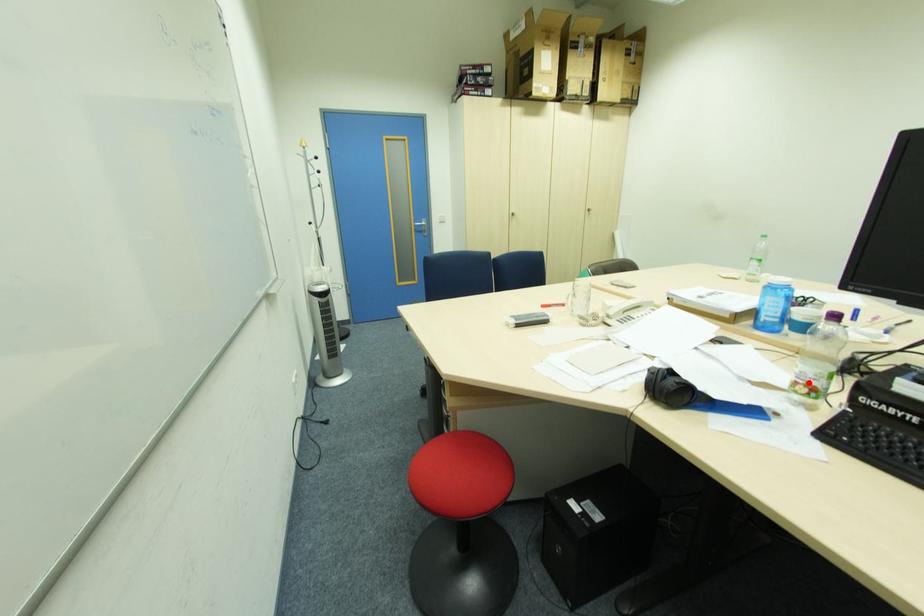
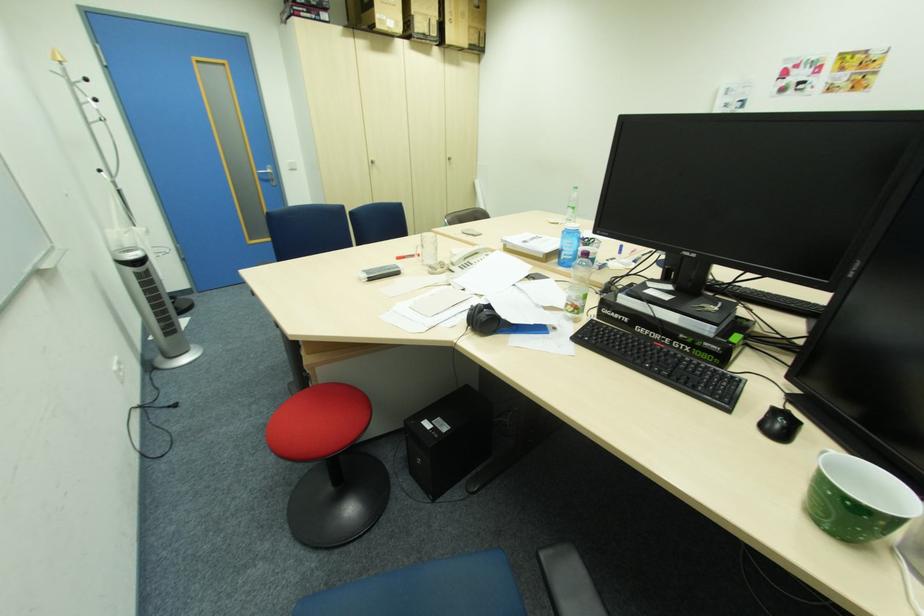
Find the pixel in the second image that matches the highlighted location in the first image.

(575, 304)